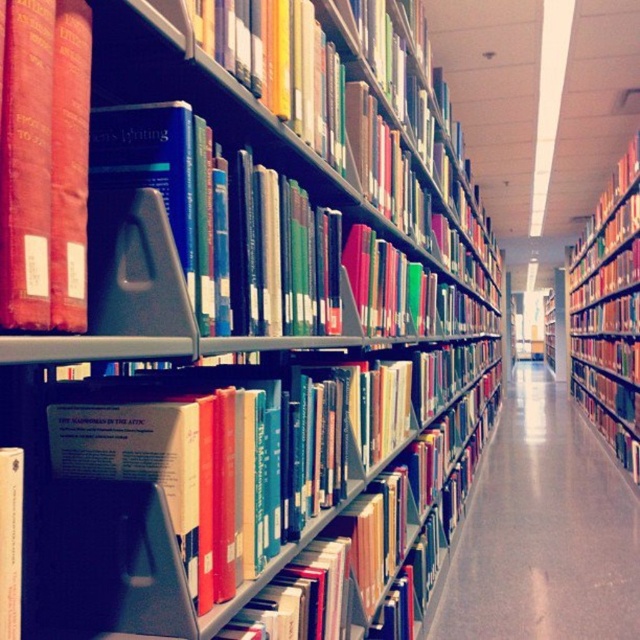
Does red matte bookcase at right have a lesser height compared to hardcover book at center?

Incorrect, red matte bookcase at right's height does not fall short of hardcover book at center's.

Locate an element on the screen. Image resolution: width=640 pixels, height=640 pixels. red matte bookcase at right is located at coordinates 609,314.

Between matte red book at left and hardcover book at center, which one appears on the left side from the viewer's perspective?

From the viewer's perspective, hardcover book at center appears more on the left side.

Between matte red book at left and hardcover book at center, which one has more height?

Standing taller between the two is matte red book at left.

Identify the location of matte red book at left. (44, 164).

Image resolution: width=640 pixels, height=640 pixels. Find the location of `matte red book at left`. matte red book at left is located at coordinates (44, 164).

From the picture: Is smooth concrete floor at center shorter than hardcover book at center?

In fact, smooth concrete floor at center may be taller than hardcover book at center.

Is point (522, 596) closer to viewer compared to point (12, 618)?

That is False.

Who is more distant from viewer, [429,637] or [10,525]?

The point [429,637] is more distant.

This screenshot has width=640, height=640. Identify the location of smooth concrete floor at center. tap(541, 529).